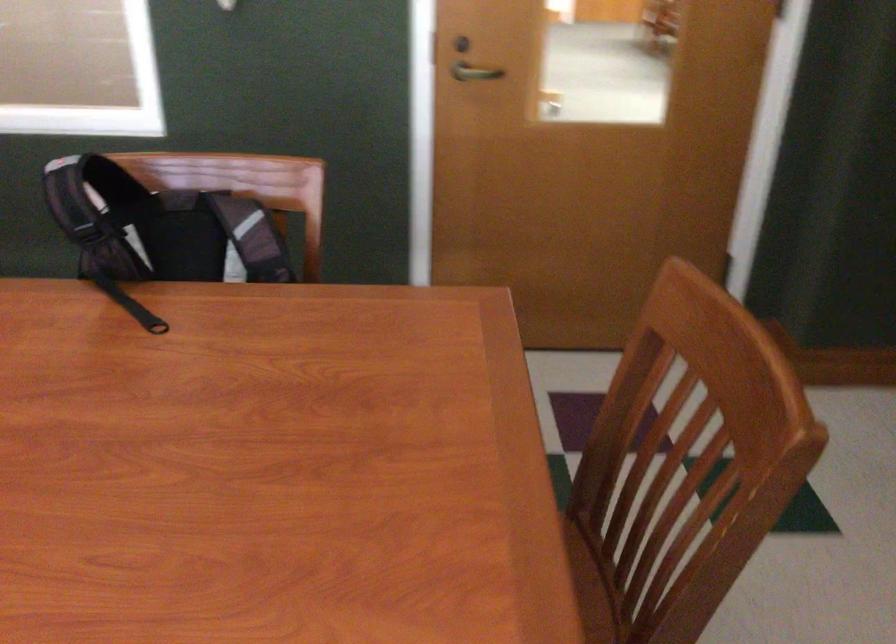
At what (x,y) coordinates should I click in order to perform the action: click on dark door handle. Please return your answer as a coordinate pair (x, y). This screenshot has width=896, height=644. Looking at the image, I should click on (460, 44).